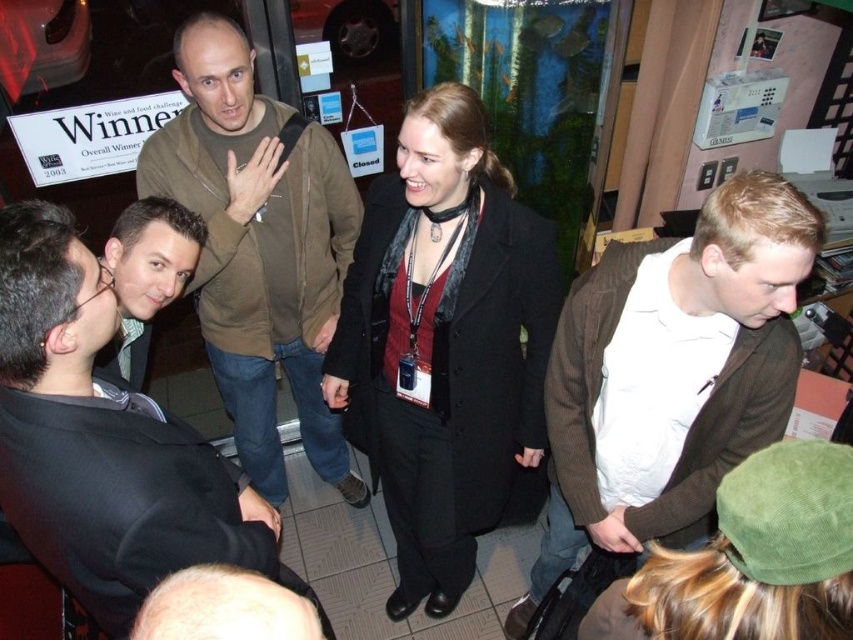
You are a photographer standing in the room and want to take a clear photo of the brown corduroy sweater at center. What is the minimum distance you need to maintain to ensure the sweater is in focus?

The minimum distance you need to maintain is 1.22 meters to ensure the brown corduroy sweater at center is in focus, as it is positioned 1.22 meters away from the viewer.

You are standing in the room and notice two points marked on the floor. The first point is at coordinate point(21,444) and the second at point(251,432). If you want to walk from the first point to the second, will you need to move forward or backward?

Since point(21,444) is in front of point(251,432), you would need to move backward to go from the first point to the second point.

You are a photographer standing at the camera position. You want to take a closeup shot of the brown corduroy sweater at center. Given that your camera has a minimum focusing distance of 1 meter, will you be able to take the photo without moving closer?

The distance between the brown corduroy sweater at center and the camera is 1.22 meters, which is greater than the camera minimum focusing distance of 1 meter. Therefore, you can take the closeup shot without moving closer.